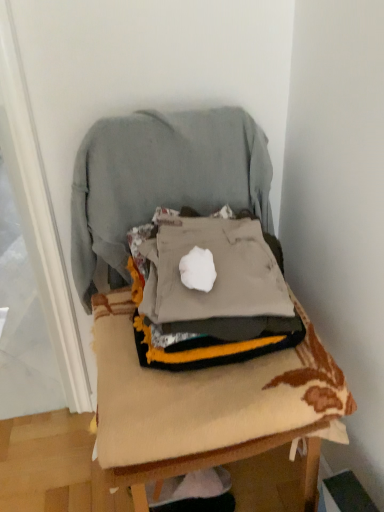
Question: Considering the relative sizes of textured beige cushion at center and gray fabric at center in the image provided, is textured beige cushion at center smaller than gray fabric at center?

Choices:
 (A) yes
 (B) no

Answer: (B)

Question: Is textured beige cushion at center oriented away from gray fabric at center?

Choices:
 (A) yes
 (B) no

Answer: (A)

Question: Does textured beige cushion at center have a lesser height compared to gray fabric at center?

Choices:
 (A) yes
 (B) no

Answer: (B)

Question: Considering the relative positions of textured beige cushion at center and gray fabric at center in the image provided, is textured beige cushion at center to the right of gray fabric at center from the viewer's perspective?

Choices:
 (A) yes
 (B) no

Answer: (B)

Question: Is textured beige cushion at center closer to camera compared to gray fabric at center?

Choices:
 (A) yes
 (B) no

Answer: (A)

Question: Is textured beige cushion at center taller than gray fabric at center?

Choices:
 (A) yes
 (B) no

Answer: (A)

Question: From the image's perspective, is gray cotton sweatshirt at center above textured beige cushion at center?

Choices:
 (A) yes
 (B) no

Answer: (A)

Question: Can you confirm if gray cotton sweatshirt at center is shorter than textured beige cushion at center?

Choices:
 (A) no
 (B) yes

Answer: (B)

Question: Is gray cotton sweatshirt at center to the left of textured beige cushion at center from the viewer's perspective?

Choices:
 (A) yes
 (B) no

Answer: (A)

Question: From the image's perspective, is gray cotton sweatshirt at center located beneath textured beige cushion at center?

Choices:
 (A) yes
 (B) no

Answer: (B)

Question: Can you confirm if gray cotton sweatshirt at center is bigger than textured beige cushion at center?

Choices:
 (A) no
 (B) yes

Answer: (A)

Question: Does gray cotton sweatshirt at center have a smaller size compared to textured beige cushion at center?

Choices:
 (A) no
 (B) yes

Answer: (B)

Question: From a real-world perspective, does gray fabric at center stand above textured beige cushion at center?

Choices:
 (A) no
 (B) yes

Answer: (A)